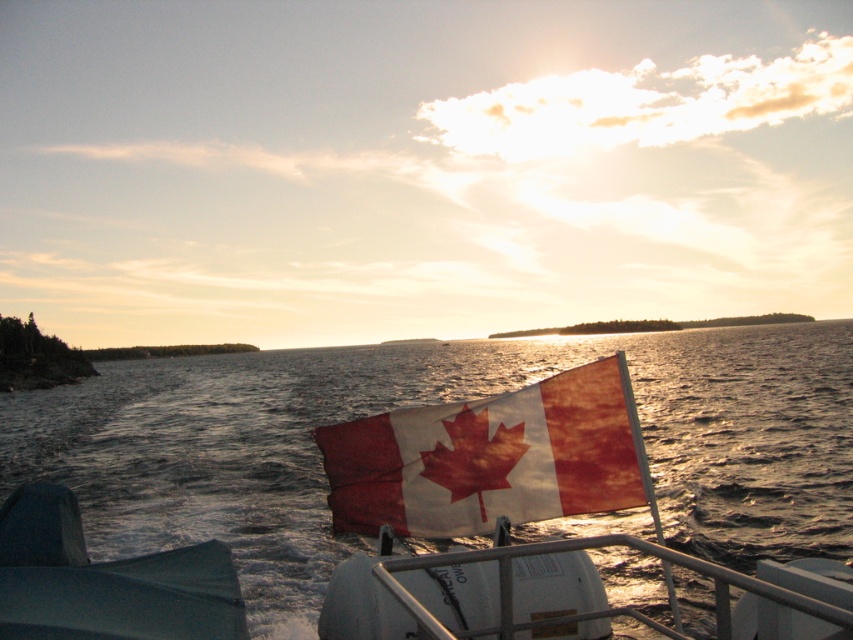
In the scene shown: You are a photographer trying to capture the Canadian flag on the boat. You notice the worn fabric flag at center and the translucent water at center. Which object is positioned higher in the scene?

The worn fabric flag at center is positioned higher than the translucent water at center, as it is placed above it.

You are a photographer trying to capture the Canadian flag and the water in the same frame. Given that your camera has a maximum focus range of 35 meters, will you be able to focus on both the worn fabric flag at center and the translucent water at center simultaneously?

The distance between the worn fabric flag at center and the translucent water at center is 34.82 meters. Since the camera can focus up to 35 meters, both objects are within the focus range, so yes, you can focus on both the worn fabric flag at center and the translucent water at center simultaneously.